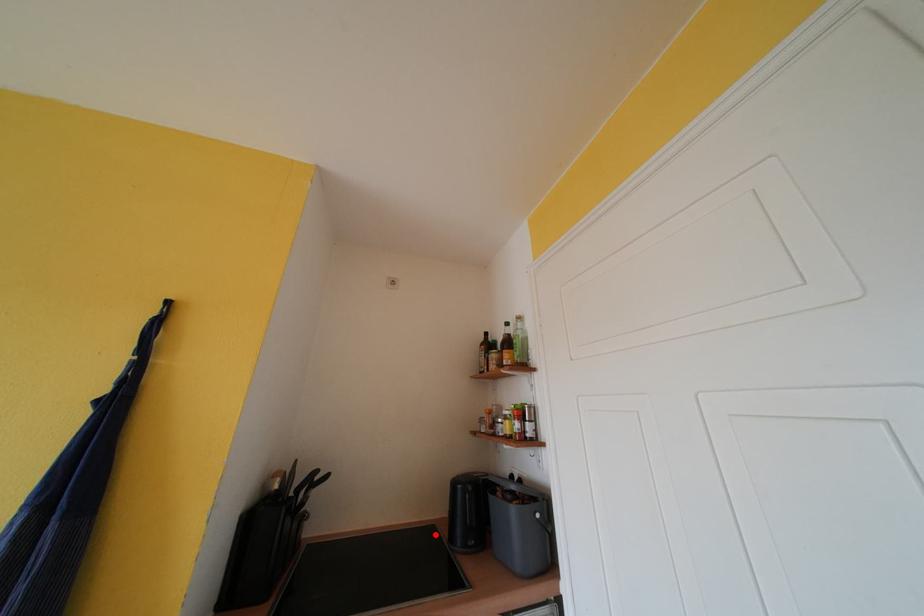
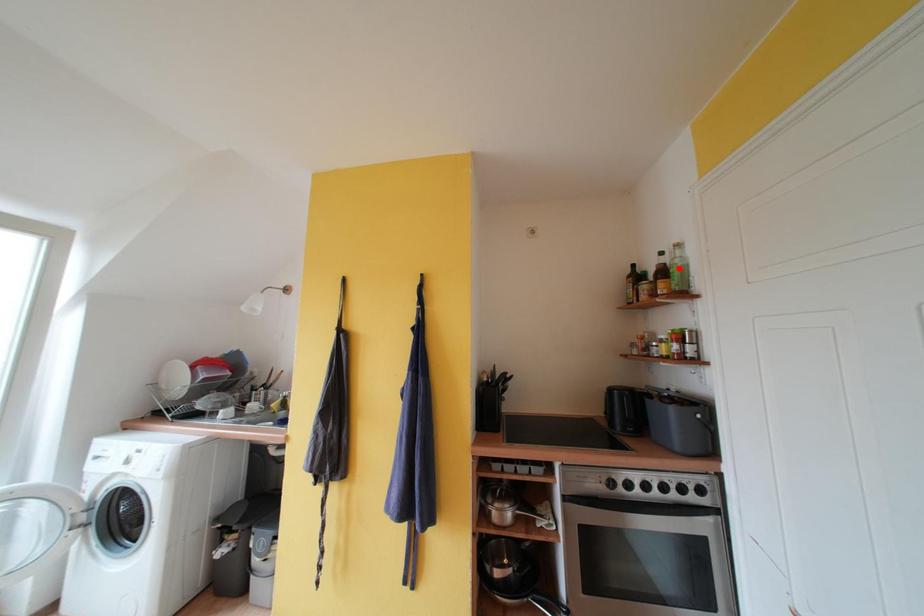
I am providing you with two images of the same scene from different viewpoints. A red point is marked on the first image and another point is marked on the second image. Are the points marked in image1 and image2 representing the same 3D position?

No